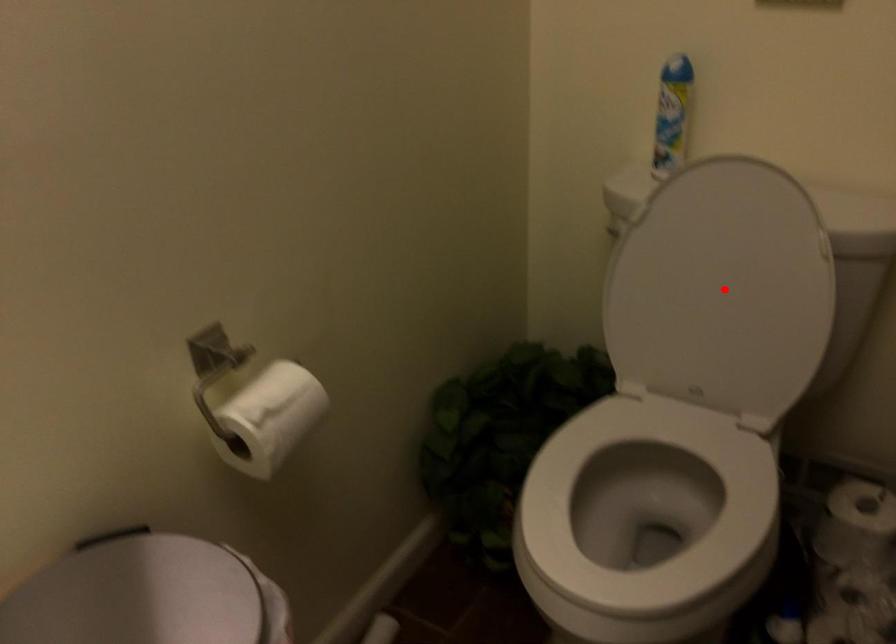
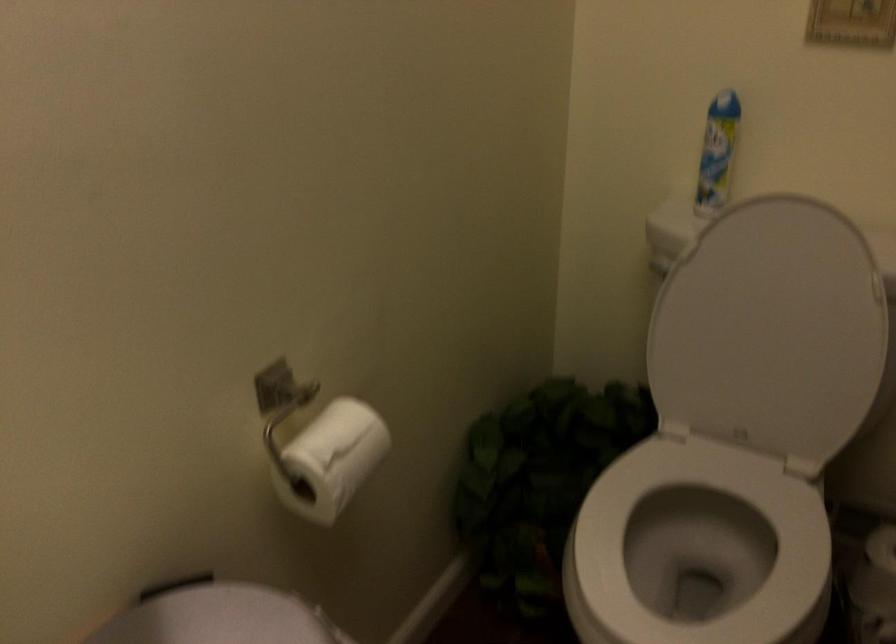
Locate, in the second image, the point that corresponds to the highlighted location in the first image.

(771, 330)